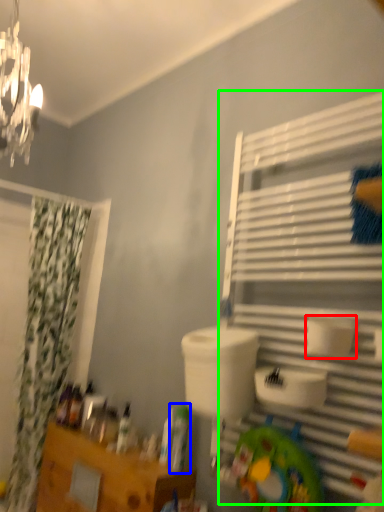
Question: Considering the real-world distances, which object is farthest from toilet paper (highlighted by a red box)? toiletry (highlighted by a blue box) or shelf (highlighted by a green box)?

Choices:
 (A) toiletry
 (B) shelf

Answer: (A)